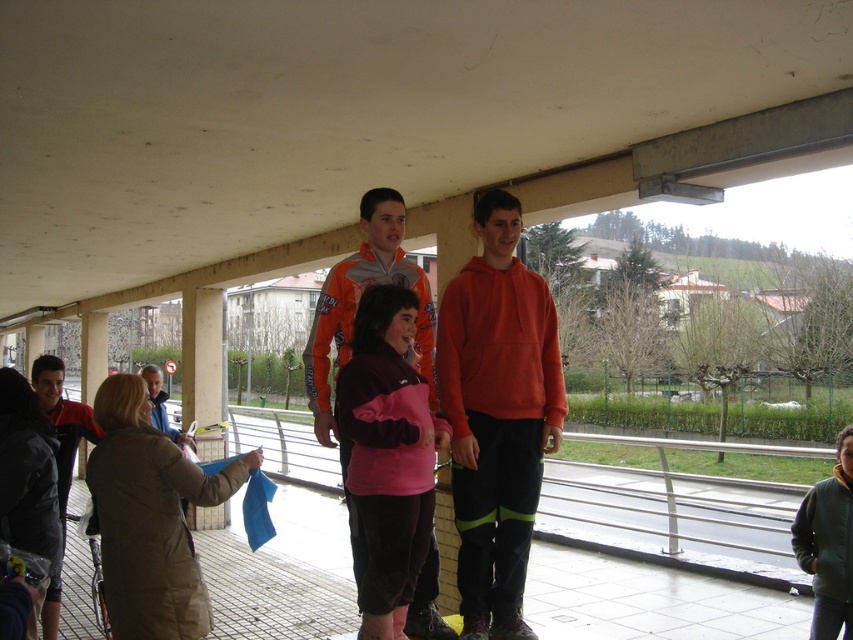
Question: Which point appears closest to the camera in this image?

Choices:
 (A) (364, 548)
 (B) (450, 410)

Answer: (A)

Question: Which of the following is the closest to the observer?

Choices:
 (A) (167, 428)
 (B) (509, 356)
 (C) (387, 477)

Answer: (C)

Question: Is orange fleece at center closer to the viewer compared to pink fleece jacket at center?

Choices:
 (A) no
 (B) yes

Answer: (A)

Question: Can you confirm if pink fleece jacket at center is positioned to the right of orange jacket at center?

Choices:
 (A) yes
 (B) no

Answer: (A)

Question: Is orange fleece at center positioned at the back of orange jacket at center?

Choices:
 (A) no
 (B) yes

Answer: (A)

Question: Which object appears farthest from the camera in this image?

Choices:
 (A) pink fleece jacket at center
 (B) orange fleece at center
 (C) orange jacket at center

Answer: (C)